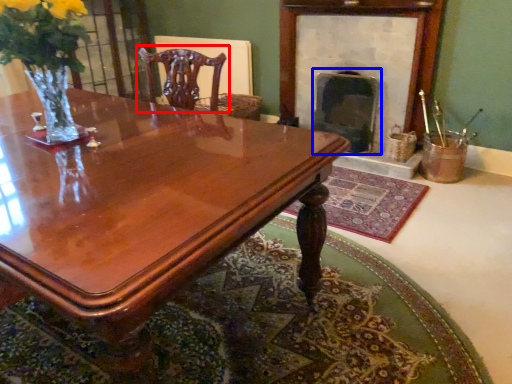
Question: Which object is closer to the camera taking this photo, chair (highlighted by a red box) or fireplace (highlighted by a blue box)?

Choices:
 (A) chair
 (B) fireplace

Answer: (B)